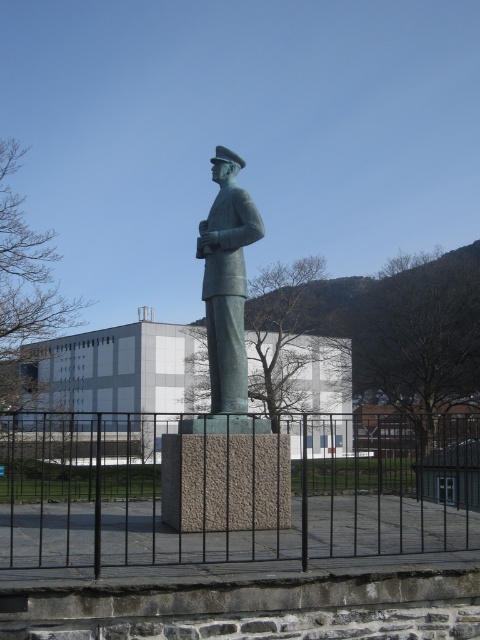
Is black metal fence at center wider than bronze statue at center?

Yes.

Is black metal fence at center positioned in front of bronze statue at center?

That is True.

The height and width of the screenshot is (640, 480). I want to click on black metal fence at center, so click(x=220, y=493).